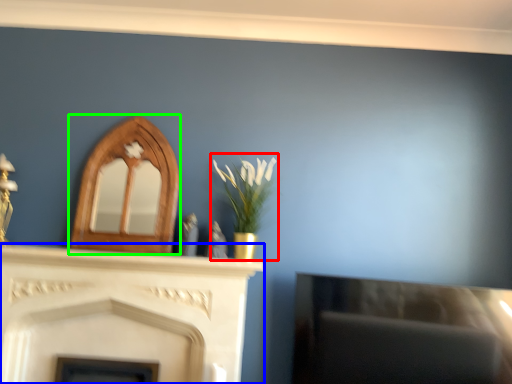
Question: Which object is positioned farthest from floral arrangement (highlighted by a red box)? Select from fireplace (highlighted by a blue box) and fireplace (highlighted by a green box).

Choices:
 (A) fireplace
 (B) fireplace

Answer: (A)